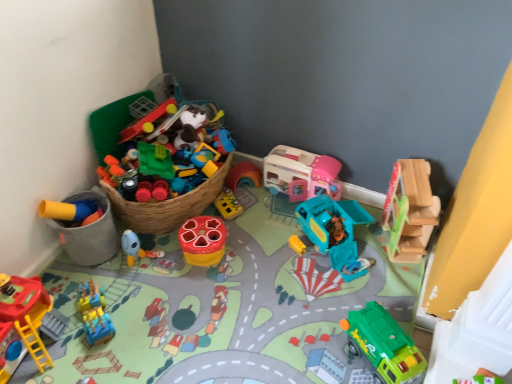
This screenshot has width=512, height=384. What are the coordinates of `vacant space situated on the left part of wooden slide at upper right, arranged as the first toy when viewed from the right` in the screenshot? It's located at (367, 248).